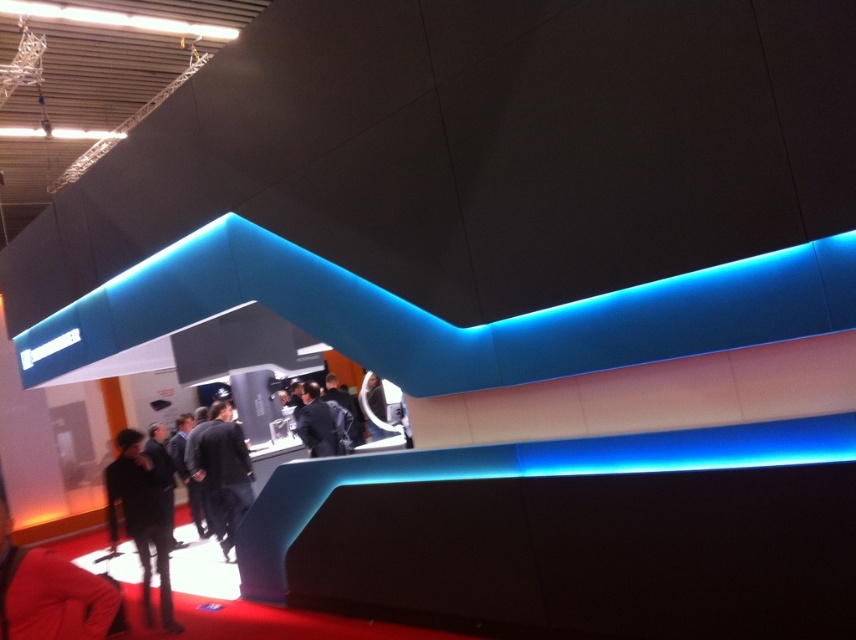
Question: Does black fabric coat at lower left have a greater width compared to black fabric suit at center?

Choices:
 (A) no
 (B) yes

Answer: (A)

Question: Which object is farther from the camera taking this photo?

Choices:
 (A) black fabric suit at center
 (B) black fabric coat at lower left

Answer: (A)

Question: Among these points, which one is nearest to the camera?

Choices:
 (A) (227, 525)
 (B) (313, 392)
 (C) (135, 531)

Answer: (C)

Question: Which object is positioned closest to the black fabric suit at center?

Choices:
 (A) black fabric coat at lower left
 (B) black suit at center

Answer: (B)

Question: Does black fabric coat at lower left lie behind black suit at center?

Choices:
 (A) no
 (B) yes

Answer: (A)

Question: Does black fabric coat at lower left appear on the left side of black fabric suit at center?

Choices:
 (A) no
 (B) yes

Answer: (B)